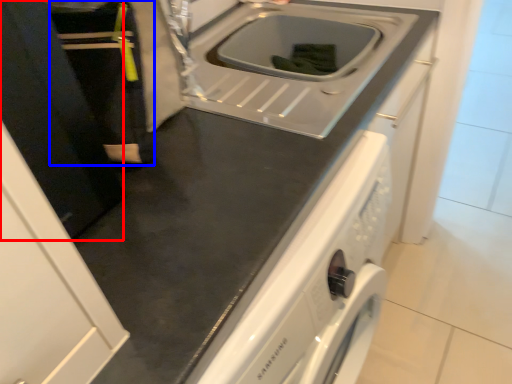
Question: Which object appears closest to the camera in this image, door (highlighted by a red box) or person (highlighted by a blue box)?

Choices:
 (A) door
 (B) person

Answer: (A)